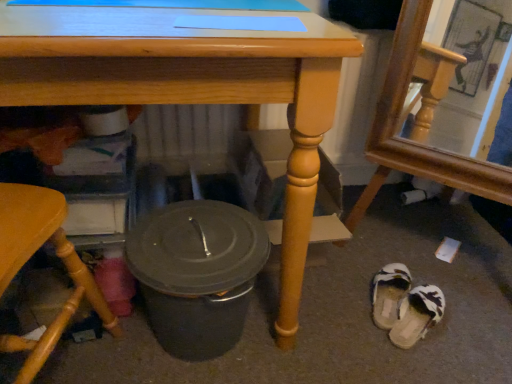
Question: In the image, is wooden frame mirror at lower right, positioned as the first chair in right-to-left order, on the left side or the right side of matte gray crock pot at lower center?

Choices:
 (A) right
 (B) left

Answer: (A)

Question: Is wooden frame mirror at lower right, positioned as the 2th chair in left-to-right order, wider or thinner than matte gray crock pot at lower center?

Choices:
 (A) thin
 (B) wide

Answer: (A)

Question: Based on their relative distances, which object is nearer to the white fabric slipper at lower right, which is the first footwear in top-to-bottom order?

Choices:
 (A) white fuzzy slippers at lower right, marked as the 1th footwear in a bottom-to-top arrangement
 (B) wooden frame mirror at lower right, positioned as the first chair in right-to-left order
 (C) matte wood table at center
 (D) matte gray crock pot at lower center
 (E) wooden chair at lower left, the 1th chair when ordered from left to right

Answer: (A)

Question: Considering the real-world distances, which object is farthest from the wooden chair at lower left, the 1th chair when ordered from left to right?

Choices:
 (A) white fuzzy slippers at lower right, arranged as the second footwear when viewed from the top
 (B) matte wood table at center
 (C) matte gray crock pot at lower center
 (D) wooden frame mirror at lower right, positioned as the 2th chair in left-to-right order
 (E) white fabric slipper at lower right, which is counted as the second footwear, starting from the bottom

Answer: (D)